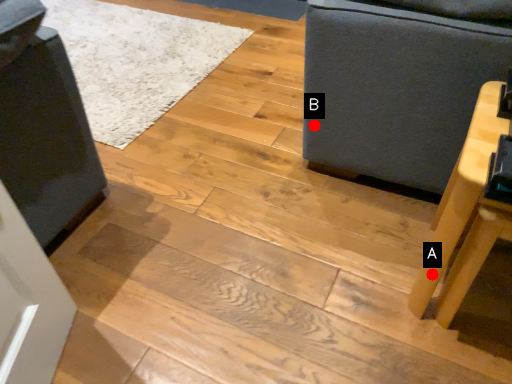
Question: Two points are circled on the image, labeled by A and B beside each circle. Which of the following is the farthest from the observer?

Choices:
 (A) A is further
 (B) B is further

Answer: (B)